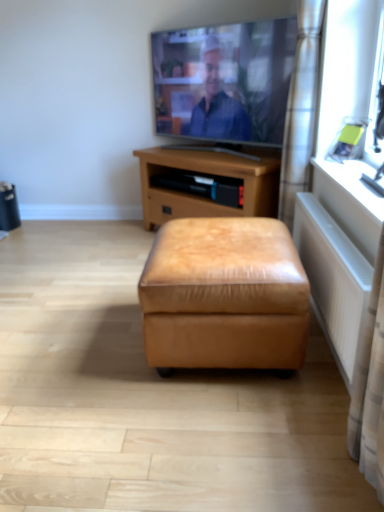
Where is `vacant space to the left of brown leather ottoman at center`? The width and height of the screenshot is (384, 512). vacant space to the left of brown leather ottoman at center is located at coordinates (105, 244).